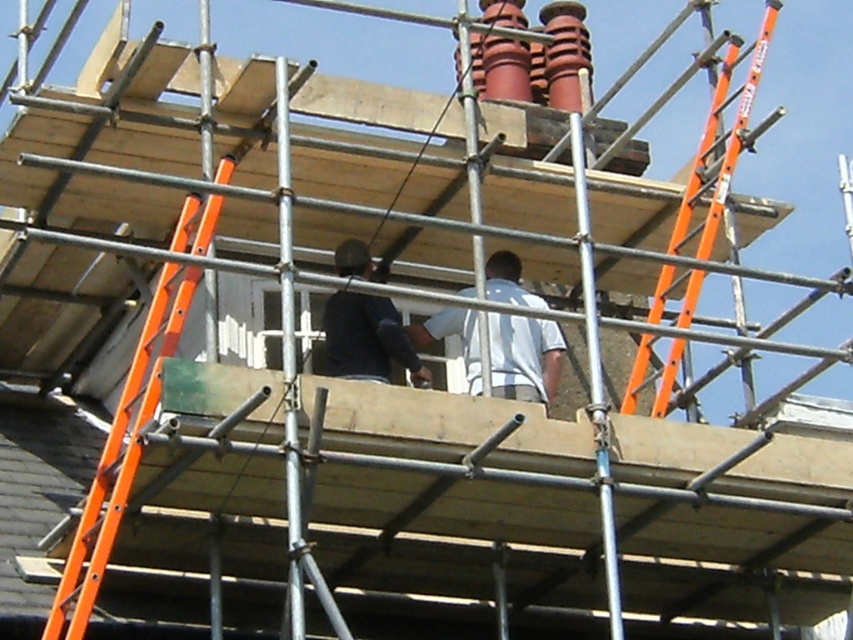
Question: Among these points, which one is farthest from the camera?

Choices:
 (A) (546, 401)
 (B) (691, 316)
 (C) (123, 481)
 (D) (341, 372)

Answer: (B)

Question: Does white matte shirt at center come in front of dark blue shirt at center?

Choices:
 (A) no
 (B) yes

Answer: (A)

Question: Which is farther from the white matte shirt at center?

Choices:
 (A) orange metallic ladder at left
 (B) orange fiberglass ladder at right
 (C) dark blue shirt at center

Answer: (A)

Question: Observing the image, what is the correct spatial positioning of orange fiberglass ladder at right in reference to white matte shirt at center?

Choices:
 (A) below
 (B) above

Answer: (B)

Question: Which is nearer to the white matte shirt at center?

Choices:
 (A) orange metallic ladder at left
 (B) dark blue shirt at center
 (C) orange fiberglass ladder at right

Answer: (B)

Question: Can you confirm if white matte shirt at center is wider than dark blue shirt at center?

Choices:
 (A) yes
 (B) no

Answer: (B)